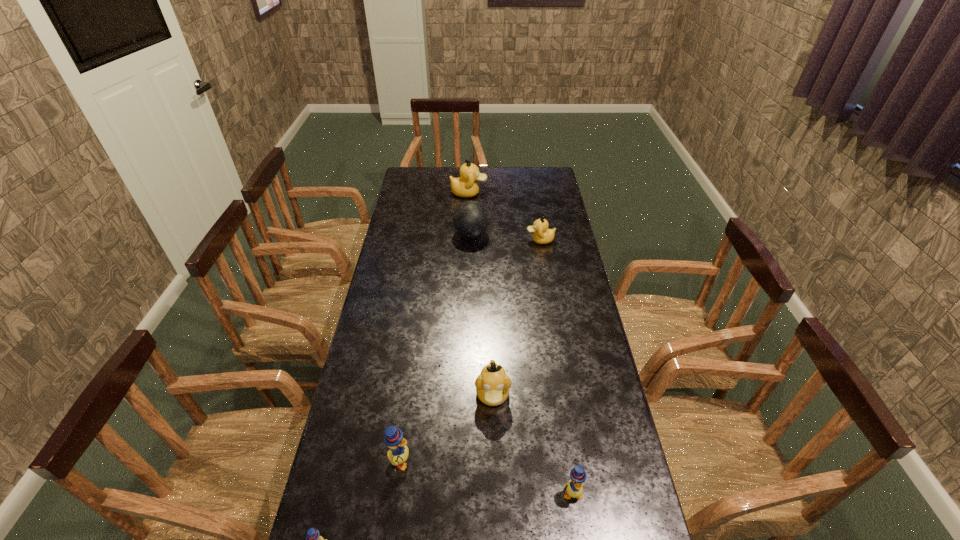
Where is `the third closest object to the sixth object from right to left`? the third closest object to the sixth object from right to left is located at coordinates (574, 488).

Locate which object is the fourth closest to the smallest tan duckling. Please provide its 2D coordinates. Your answer should be formatted as a tuple, i.e. [(x, y)], where the tuple contains the x and y coordinates of a point satisfying the conditions above.

[(398, 454)]

The height and width of the screenshot is (540, 960). Find the location of `duckling that stands as the closest to the second biggest yellow duckling`. duckling that stands as the closest to the second biggest yellow duckling is located at coordinates pos(492,385).

Point out which duckling is positioned as the second nearest to the second farthest yellow duckling. Please provide its 2D coordinates. Your answer should be formatted as a tuple, i.e. [(x, y)], where the tuple contains the x and y coordinates of a point satisfying the conditions above.

[(398, 454)]

Find the location of a particular element. The image size is (960, 540). tan duckling that is the second closest to the farthest tan duckling is located at coordinates (492, 385).

Where is `the second closest tan duckling to the nearest tan duckling`? The height and width of the screenshot is (540, 960). the second closest tan duckling to the nearest tan duckling is located at coordinates (465, 186).

Point out which yellow duckling is positioned as the second nearest to the farthest yellow duckling. Please provide its 2D coordinates. Your answer should be formatted as a tuple, i.e. [(x, y)], where the tuple contains the x and y coordinates of a point satisfying the conditions above.

[(574, 488)]

Point out which yellow duckling is positioned as the second nearest to the shortest object. Please provide its 2D coordinates. Your answer should be formatted as a tuple, i.e. [(x, y)], where the tuple contains the x and y coordinates of a point satisfying the conditions above.

[(574, 488)]

Where is `vacant point that satisfies the following two spatial constraints: 1. on the face of the fourth nearest object; 2. on the face of the second yellow duckling from left to right, where the monocle is placed`? vacant point that satisfies the following two spatial constraints: 1. on the face of the fourth nearest object; 2. on the face of the second yellow duckling from left to right, where the monocle is placed is located at coordinates (494, 461).

At what (x,y) coordinates should I click in order to perform the action: click on vacant space that satisfies the following two spatial constraints: 1. on the face of the smallest tan duckling; 2. on the face of the fourth nearest duckling. Please return your answer as a coordinate pair (x, y). This screenshot has height=540, width=960. Looking at the image, I should click on (566, 396).